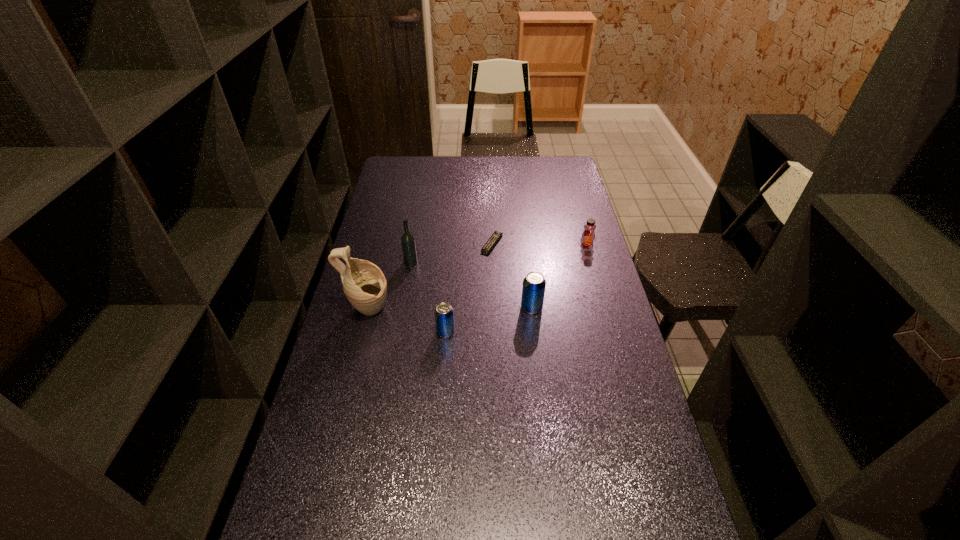
The image size is (960, 540). Find the location of `vacant region at the left edge of the desktop`. vacant region at the left edge of the desktop is located at coordinates (385, 237).

I want to click on free spot at the right edge of the desktop, so click(x=634, y=380).

The image size is (960, 540). Identify the location of free space at the near left corner. (335, 536).

At what (x,y) coordinates should I click in order to perform the action: click on vacant space that's between the shorter beer can and the honey. Please return your answer as a coordinate pair (x, y). Looking at the image, I should click on (516, 288).

The height and width of the screenshot is (540, 960). I want to click on empty location between the fourth nearest object and the leftmost object, so click(x=390, y=286).

You are a GUI agent. You are given a task and a screenshot of the screen. Output one action in this format:
    pyautogui.click(x=<x>, y=<y>)
    Task: Click on the free point between the remote control and the leftmost object
    
    Given the screenshot: What is the action you would take?
    pyautogui.click(x=430, y=277)

Where is `vacant space that's between the honey and the right beer can`? This screenshot has width=960, height=540. vacant space that's between the honey and the right beer can is located at coordinates (559, 276).

Where is `vacant area that lies between the third tallest object and the honey`? The width and height of the screenshot is (960, 540). vacant area that lies between the third tallest object and the honey is located at coordinates (559, 276).

I want to click on empty space between the fifth object from left to right and the vodka, so click(x=471, y=285).

Locate an element on the screen. The height and width of the screenshot is (540, 960). free space between the honey and the second object from right to left is located at coordinates (559, 276).